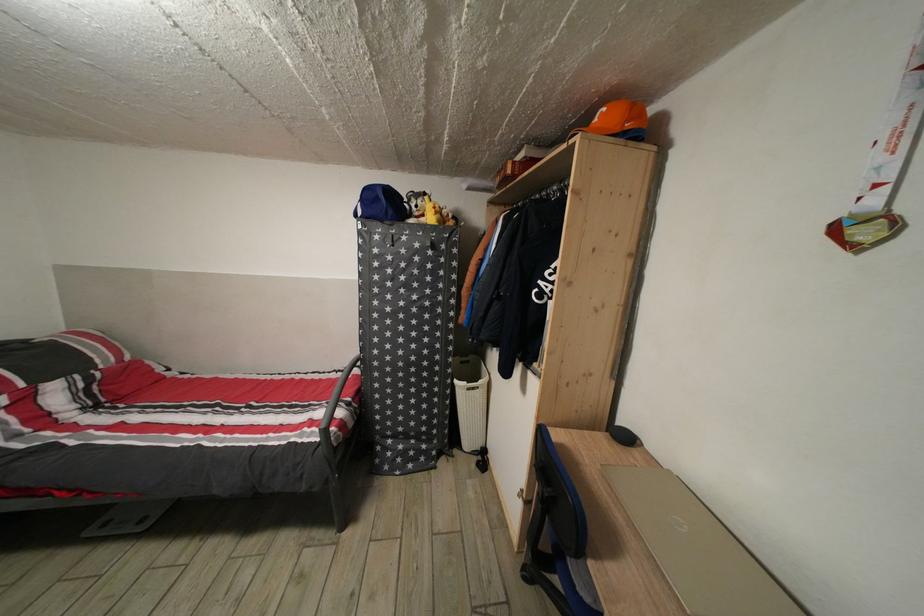
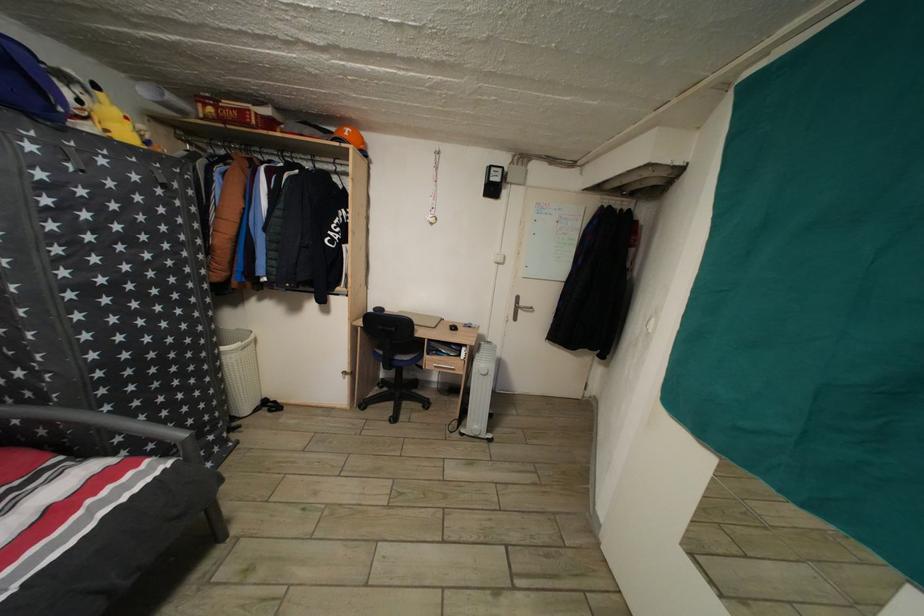
The point at (x=441, y=214) is marked in the first image. Where is the corresponding point in the second image?

(134, 124)